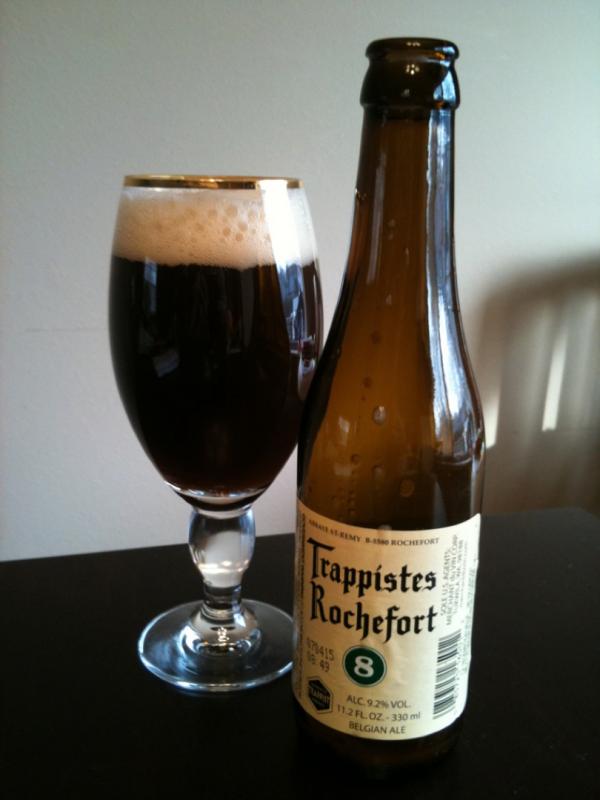
Identify the location of glass base. (234, 672).